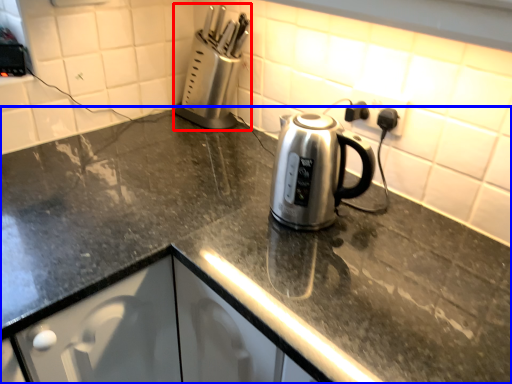
Question: Among these objects, which one is nearest to the camera, appliance (highlighted by a red box) or countertop (highlighted by a blue box)?

Choices:
 (A) appliance
 (B) countertop

Answer: (B)